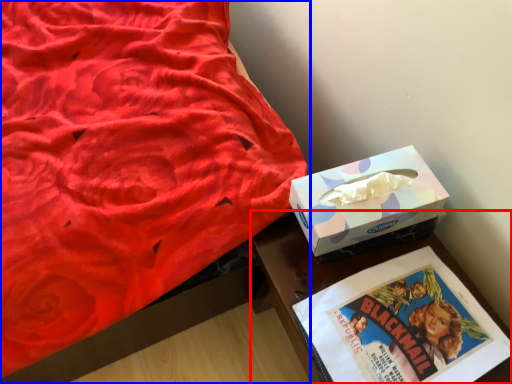
Question: Which object appears farthest to the camera in this image, table (highlighted by a red box) or bed (highlighted by a blue box)?

Choices:
 (A) table
 (B) bed

Answer: (A)